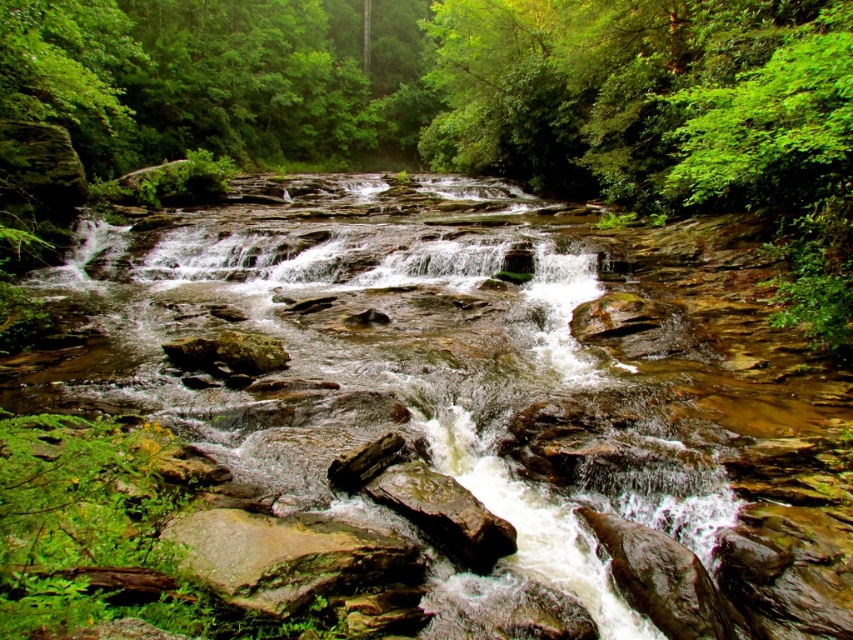
You are a hiker carrying a 3.5 meter long telescoping pole. You need to cross the stream but there is a gap between the brown rock mountain stream at center and the rusty metallic rock at center. Can your pole span the gap to help you cross?

The distance between the brown rock mountain stream at center and the rusty metallic rock at center is 3.73 meters. Since your telescoping pole is 3.5 meters long, it is shorter than the gap. Therefore, the pole cannot span the gap to help you cross safely.

You are a hiker who wants to cross the stream safely. You see the brown rock mountain stream at center and the rusty metallic rock at center. Which one should you step on to avoid getting wet?

The brown rock mountain stream at center is bigger than the rusty metallic rock at center, so stepping on the brown rock mountain stream at center would provide a larger, more stable surface to avoid getting wet.

You are standing at the edge of the brown rock mountain stream at center and want to cross to the other side. The stream flows from the upper left to the lower right. There is a large boulder at point (492, 394). Can you safely step onto the boulder to cross?

The brown rock mountain stream at center flows from upper left to lower right. The large boulder is located at point (492, 394). Since the boulder is part of the stream bed, it is a stable surface to step on for crossing.